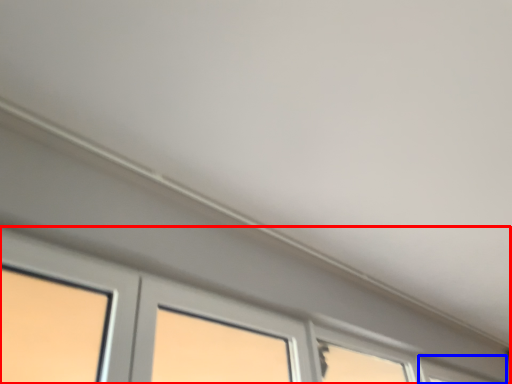
Question: Which point is closer to the camera, window (highlighted by a red box) or window (highlighted by a blue box)?

Choices:
 (A) window
 (B) window

Answer: (A)